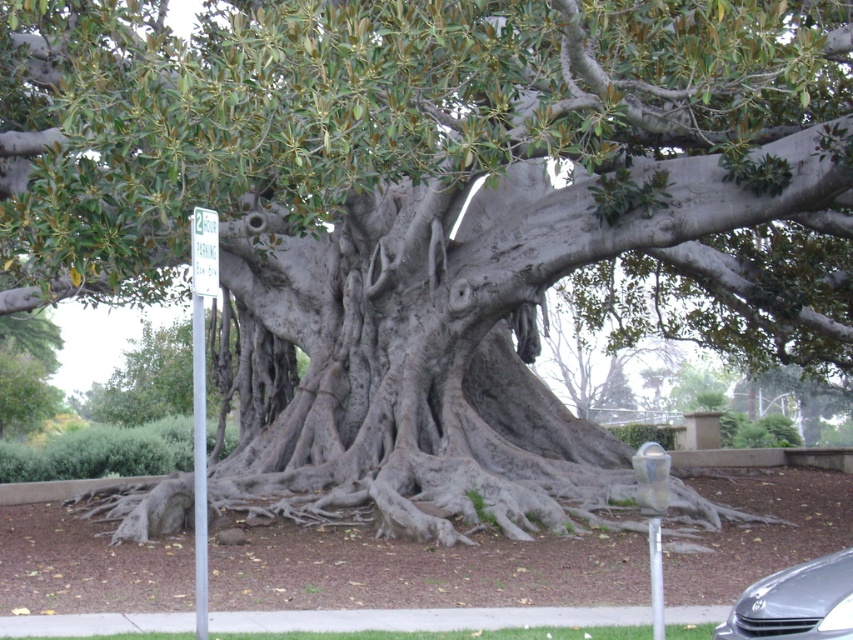
From the picture: Can you confirm if metallic gray car at lower right is thinner than white plastic parking sign at upper left?

Incorrect, metallic gray car at lower right's width is not less than white plastic parking sign at upper left's.

Who is lower down, metallic gray car at lower right or white plastic parking sign at upper left?

metallic gray car at lower right

Is point (781, 596) closer to camera compared to point (204, 241)?

Yes, it is.

The width and height of the screenshot is (853, 640). In order to click on metallic gray car at lower right in this screenshot , I will do `click(796, 602)`.

Based on the photo, is white plastic sign at left above white plastic parking sign at upper left?

Incorrect, white plastic sign at left is not positioned above white plastic parking sign at upper left.

The height and width of the screenshot is (640, 853). What do you see at coordinates (201, 392) in the screenshot?
I see `white plastic sign at left` at bounding box center [201, 392].

Locate an element on the screen. white plastic sign at left is located at coordinates (201, 392).

Measure the distance between point (833,573) and camera.

Point (833,573) and camera are 4.59 meters apart.

Does metallic gray car at lower right have a lesser width compared to white plastic sign at left?

Indeed, metallic gray car at lower right has a lesser width compared to white plastic sign at left.

Which is in front, point (811, 570) or point (192, 378)?

Point (811, 570) is in front.

Identify the location of metallic gray car at lower right. The width and height of the screenshot is (853, 640). (796, 602).